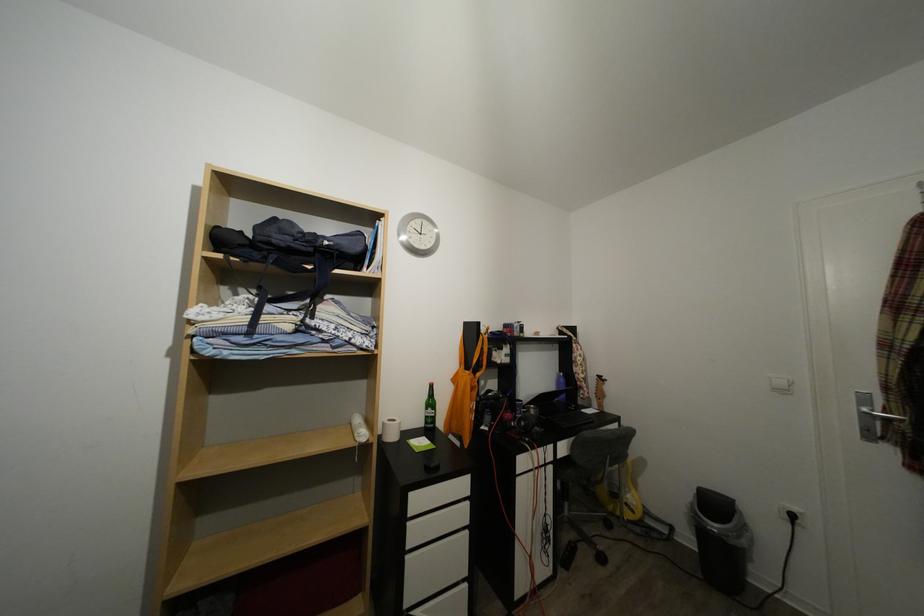
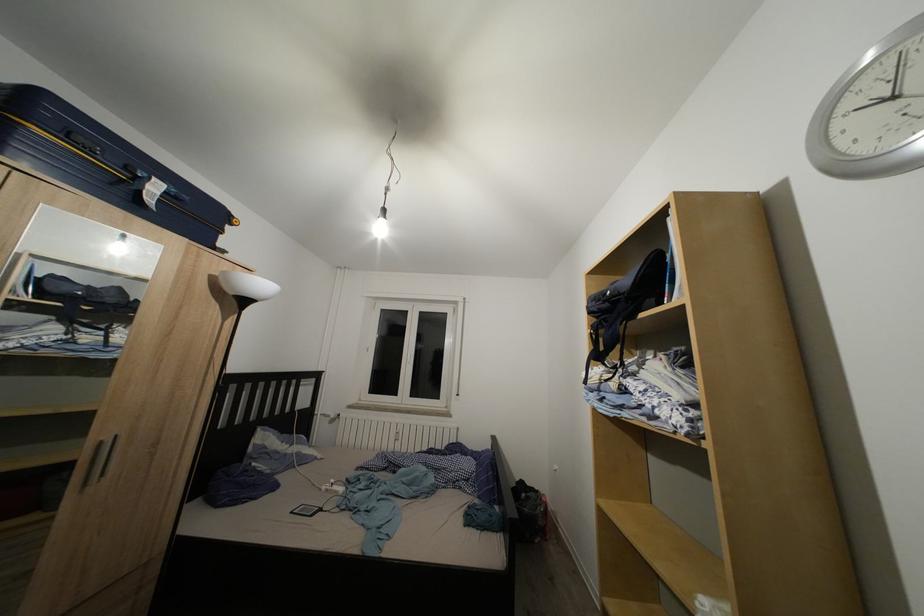
In the second image, find the point that corresponds to the point at 290,251 in the first image.

(602, 315)